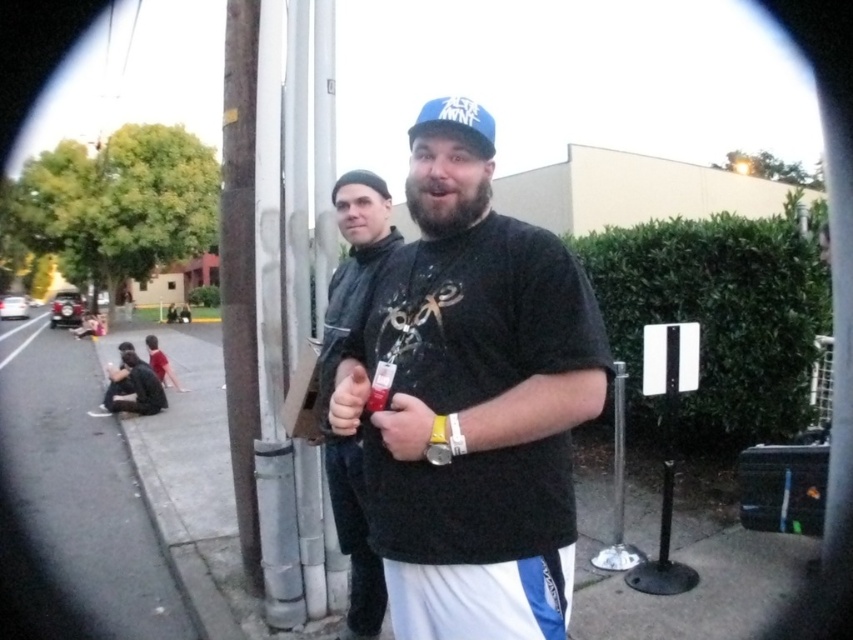
Is point (412, 611) in front of point (347, 177)?

Yes, point (412, 611) is closer to viewer.

Does black matte t-shirt at center have a larger size compared to matte black jacket at center?

No, black matte t-shirt at center is not bigger than matte black jacket at center.

Between point (474, 566) and point (373, 636), which one is positioned behind?

The point (373, 636) is more distant.

Locate an element on the screen. This screenshot has width=853, height=640. black matte t-shirt at center is located at coordinates (473, 400).

Which of these two, gray asphalt pavement at lower left or matte black jacket at center, stands taller?

matte black jacket at center

Is point (44, 426) positioned behind point (328, 387)?

Yes, point (44, 426) is behind point (328, 387).

Does point (74, 442) lie in front of point (340, 531)?

That is False.

Where is `gray asphalt pavement at lower left`? gray asphalt pavement at lower left is located at coordinates (80, 486).

Does black matte t-shirt at center have a lesser width compared to gray asphalt pavement at lower left?

Indeed, black matte t-shirt at center has a lesser width compared to gray asphalt pavement at lower left.

This screenshot has height=640, width=853. What do you see at coordinates (473, 400) in the screenshot?
I see `black matte t-shirt at center` at bounding box center [473, 400].

Who is more distant from viewer, (503,371) or (19,461)?

Positioned behind is point (19,461).

The image size is (853, 640). In order to click on black matte t-shirt at center in this screenshot , I will do `click(473, 400)`.